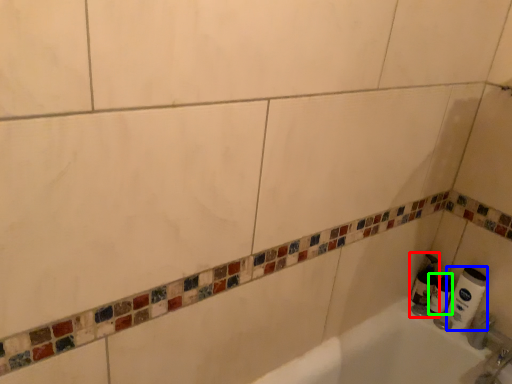
Question: Which object is positioned farthest from soap dispenser (highlighted by a red box)? Select from toilet paper (highlighted by a blue box) and toilet paper (highlighted by a green box).

Choices:
 (A) toilet paper
 (B) toilet paper

Answer: (A)